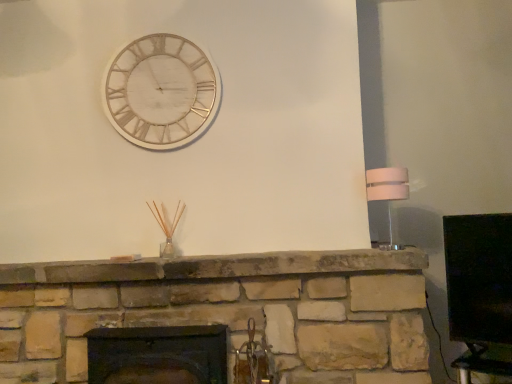
Question: Does dark brown wood fireplace at center appear on the left side of white marble clock at upper center?

Choices:
 (A) yes
 (B) no

Answer: (B)

Question: Is dark brown wood fireplace at center beside white marble clock at upper center?

Choices:
 (A) no
 (B) yes

Answer: (A)

Question: Considering the relative sizes of dark brown wood fireplace at center and white marble clock at upper center in the image provided, is dark brown wood fireplace at center smaller than white marble clock at upper center?

Choices:
 (A) no
 (B) yes

Answer: (A)

Question: Is white marble clock at upper center inside dark brown wood fireplace at center?

Choices:
 (A) no
 (B) yes

Answer: (A)

Question: From a real-world perspective, is dark brown wood fireplace at center below white marble clock at upper center?

Choices:
 (A) no
 (B) yes

Answer: (B)

Question: From a real-world perspective, is dark brown wood fireplace at center over white marble clock at upper center?

Choices:
 (A) yes
 (B) no

Answer: (B)

Question: Can you confirm if white marble clock at upper center is wider than white glossy lampshade at right?

Choices:
 (A) no
 (B) yes

Answer: (A)

Question: From a real-world perspective, is white marble clock at upper center positioned under white glossy lampshade at right based on gravity?

Choices:
 (A) yes
 (B) no

Answer: (B)

Question: From a real-world perspective, is white marble clock at upper center physically above white glossy lampshade at right?

Choices:
 (A) no
 (B) yes

Answer: (B)

Question: Is white marble clock at upper center aimed at white glossy lampshade at right?

Choices:
 (A) no
 (B) yes

Answer: (A)

Question: Considering the relative positions of white marble clock at upper center and white glossy lampshade at right in the image provided, is white marble clock at upper center to the right of white glossy lampshade at right from the viewer's perspective?

Choices:
 (A) no
 (B) yes

Answer: (A)

Question: Is white marble clock at upper center thinner than white glossy lampshade at right?

Choices:
 (A) no
 (B) yes

Answer: (B)

Question: Is white marble clock at upper center facing away from dark brown wood fireplace at center?

Choices:
 (A) yes
 (B) no

Answer: (B)